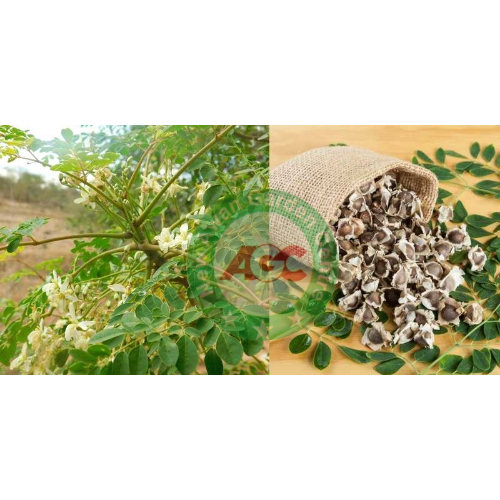
This screenshot has width=500, height=500. In order to click on burlap fabric in this screenshot , I will do `click(332, 172)`.